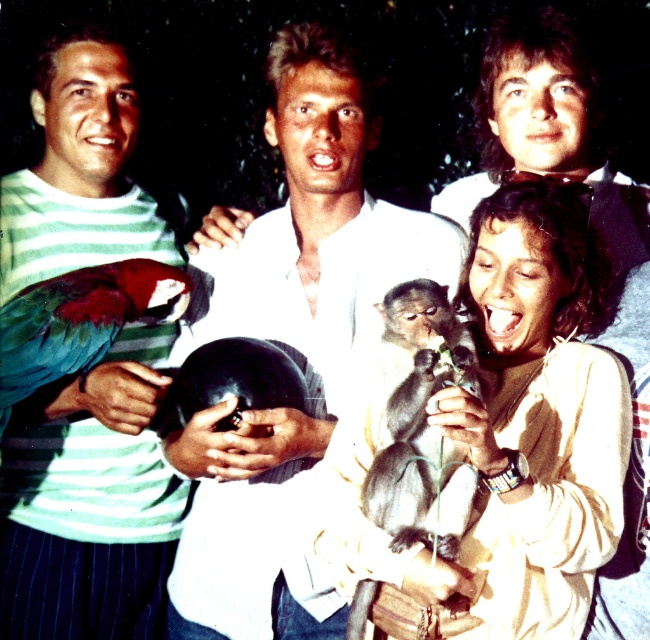
You are a photographer trying to focus on the smooth beige sweater at center. What are the coordinates where you should aim your camera?

The smooth beige sweater at center is located at coordinates point (x=538, y=404). Aim your camera there to focus on it.

You are a photographer trying to capture a clear shot of the white matte shirt at center and the green matte parrot at left. Since the scene is dark, you need to adjust your camera focus. Which object should you focus on first to ensure it appears sharp in the photo?

The white matte shirt at center is in front of the green matte parrot at left, so you should focus on the white matte shirt at center first to ensure it appears sharp.

You are a photographer adjusting your camera settings to focus on the smooth beige sweater at center. The camera has a focus point at coordinates point (538, 404). Is the focus point correctly positioned to capture the smooth beige sweater at center?

Yes, the focus point at point (538, 404) is correctly positioned to capture the smooth beige sweater at center as the description states that this point marks the location of the sweater.